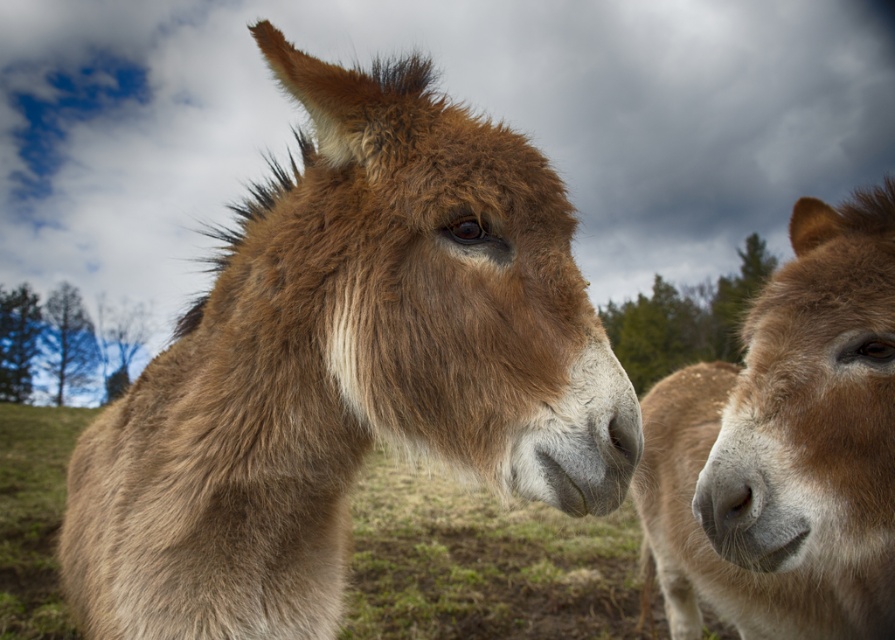
Question: Which object appears farthest from the camera in this image?

Choices:
 (A) brown fuzzy donkey at center
 (B) brown fuzzy nose at center
 (C) brown fuzzy donkey at right

Answer: (C)

Question: Which point appears farthest from the camera in this image?

Choices:
 (A) (286, 580)
 (B) (638, 440)

Answer: (A)

Question: Is brown fuzzy donkey at center wider than brown fuzzy donkey at right?

Choices:
 (A) no
 (B) yes

Answer: (B)

Question: Estimate the real-world distances between objects in this image. Which object is farther from the brown fuzzy donkey at center?

Choices:
 (A) brown fuzzy donkey at right
 (B) brown fuzzy nose at center

Answer: (A)

Question: Is brown fuzzy donkey at center wider than brown fuzzy donkey at right?

Choices:
 (A) no
 (B) yes

Answer: (B)

Question: Does brown fuzzy donkey at center appear over brown fuzzy nose at center?

Choices:
 (A) no
 (B) yes

Answer: (A)